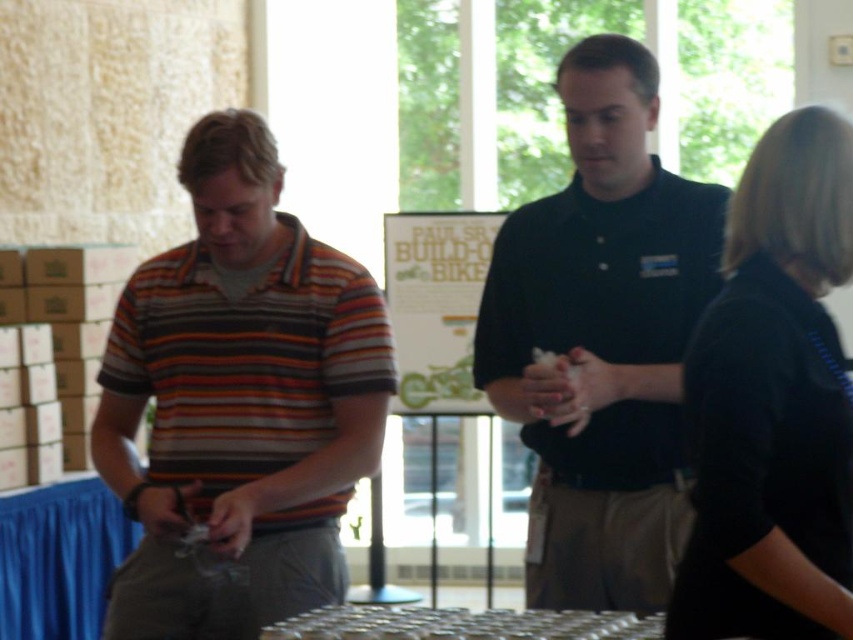
Question: Can you confirm if black matte shirt at right is thinner than metallic silver table at lower center?

Choices:
 (A) no
 (B) yes

Answer: (B)

Question: Which object appears closest to the camera in this image?

Choices:
 (A) black matte shirt at right
 (B) metallic silver table at lower center
 (C) dark blue shirt at center

Answer: (A)

Question: Which point is farther from the camera taking this photo?

Choices:
 (A) (502, 627)
 (B) (514, 230)
 (C) (844, 637)
 (D) (329, 426)

Answer: (B)

Question: Which object is positioned farthest from the striped cotton shirt at left?

Choices:
 (A) dark blue shirt at center
 (B) black matte shirt at right
 (C) metallic silver table at lower center

Answer: (B)

Question: Can you confirm if black matte shirt at right is positioned below metallic silver table at lower center?

Choices:
 (A) no
 (B) yes

Answer: (A)

Question: Can you confirm if dark blue shirt at center is positioned below black matte shirt at right?

Choices:
 (A) yes
 (B) no

Answer: (B)